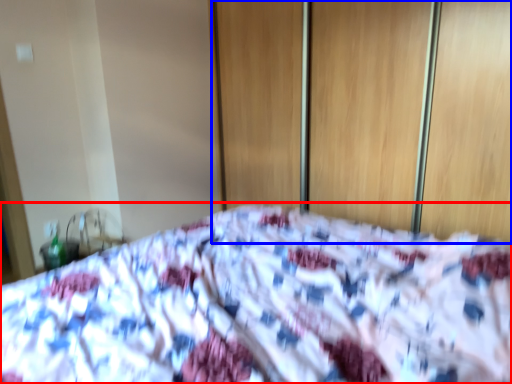
Question: Which object is closer to the camera taking this photo, bed (highlighted by a red box) or screen door (highlighted by a blue box)?

Choices:
 (A) bed
 (B) screen door

Answer: (A)